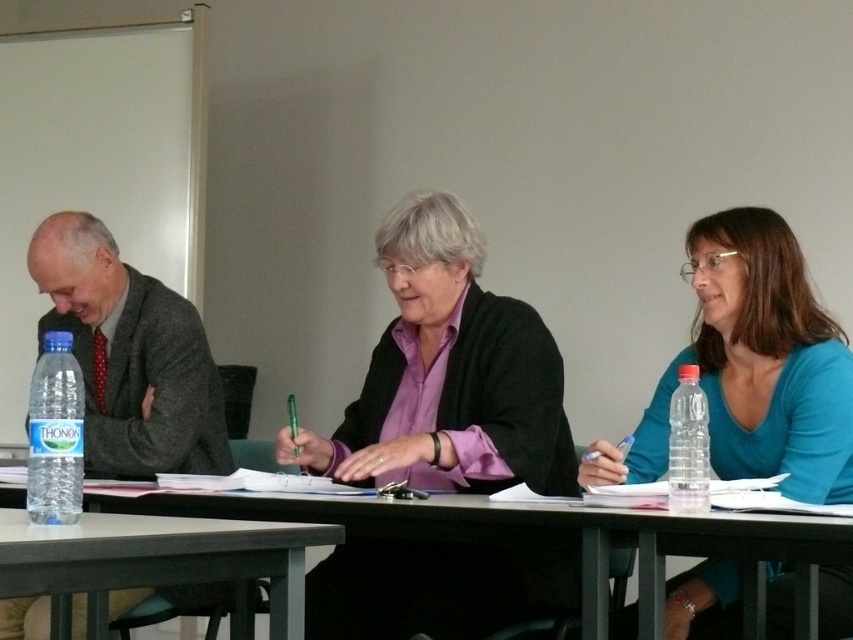
Which is behind, point (102, 305) or point (683, 371)?

The point (102, 305) is more distant.

Between gray woolen suit at left and clear plastic bottle at right, which one is positioned higher?

gray woolen suit at left is above.

This screenshot has height=640, width=853. I want to click on gray woolen suit at left, so point(129,355).

Is point (763, 548) positioned in front of point (33, 474)?

No.

Can you confirm if smooth gray table at center is smaller than clear plastic bottle at left?

Actually, smooth gray table at center might be larger than clear plastic bottle at left.

Is point (843, 525) positioned in front of point (42, 349)?

Yes, point (843, 525) is in front of point (42, 349).

Where is `smooth gray table at center`? The width and height of the screenshot is (853, 640). smooth gray table at center is located at coordinates (541, 534).

Does blue matte shirt at center appear over gray woolen suit at left?

No, blue matte shirt at center is not above gray woolen suit at left.

Does point (793, 460) come in front of point (213, 392)?

Yes, it is.

What do you see at coordinates (752, 368) in the screenshot?
I see `blue matte shirt at center` at bounding box center [752, 368].

This screenshot has height=640, width=853. I want to click on blue matte shirt at center, so click(x=752, y=368).